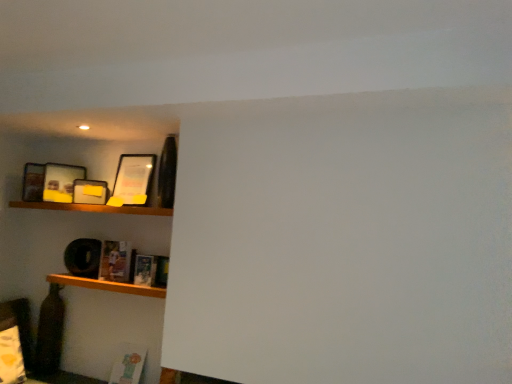
Image resolution: width=512 pixels, height=384 pixels. What do you see at coordinates (90, 192) in the screenshot? I see `matte yellow picture frame at upper left, arranged as the second picture frame when viewed from the left` at bounding box center [90, 192].

Measure the distance between point (74, 284) and camera.

Point (74, 284) and camera are 3.23 meters apart from each other.

Based on the photo, what is the approximate width of wooden shelf at upper left, the second shelf positioned from the bottom?

13.54 inches.

Find the location of `matte wooden picture frame at upper left, the third picture frame viewed from the left`. matte wooden picture frame at upper left, the third picture frame viewed from the left is located at coordinates (133, 179).

From a real-world perspective, is matte wooden picture frame at upper left, marked as the first picture frame in a right-to-left arrangement, physically located above or below matte yellow picture frame at upper left, arranged as the second picture frame when viewed from the left?

matte wooden picture frame at upper left, marked as the first picture frame in a right-to-left arrangement, is above matte yellow picture frame at upper left, arranged as the second picture frame when viewed from the left.

Does matte wooden picture frame at upper left, the third picture frame viewed from the left, turn towards matte yellow picture frame at upper left, the second picture frame when ordered from right to left?

No, matte wooden picture frame at upper left, the third picture frame viewed from the left, is not oriented towards matte yellow picture frame at upper left, the second picture frame when ordered from right to left.

Considering the sizes of matte wooden picture frame at upper left, marked as the first picture frame in a right-to-left arrangement, and matte yellow picture frame at upper left, arranged as the second picture frame when viewed from the left, in the image, is matte wooden picture frame at upper left, marked as the first picture frame in a right-to-left arrangement, bigger or smaller than matte yellow picture frame at upper left, arranged as the second picture frame when viewed from the left,?

Clearly, matte wooden picture frame at upper left, marked as the first picture frame in a right-to-left arrangement, is larger in size than matte yellow picture frame at upper left, arranged as the second picture frame when viewed from the left.

Is matte wooden picture frame at upper left, the third picture frame viewed from the left, far away from matte yellow picture frame at upper left, the second picture frame when ordered from right to left?

matte wooden picture frame at upper left, the third picture frame viewed from the left, is near matte yellow picture frame at upper left, the second picture frame when ordered from right to left, not far away.

Would you say hardcover book at lower left, which is the second book in back-to-front order, is inside or outside wooden shelf at lower left, which ranks as the 1th shelf in bottom-to-top order?

hardcover book at lower left, which is the second book in back-to-front order, exists outside the volume of wooden shelf at lower left, which ranks as the 1th shelf in bottom-to-top order.

Based on their positions, is hardcover book at lower left, the first book in the front-to-back sequence, located to the left or right of wooden shelf at lower left, the 2th shelf when ordered from top to bottom?

Based on their positions, hardcover book at lower left, the first book in the front-to-back sequence, is located to the right of wooden shelf at lower left, the 2th shelf when ordered from top to bottom.

Is hardcover book at lower left, the first book in the front-to-back sequence, beside wooden shelf at lower left, which ranks as the 1th shelf in bottom-to-top order?

No.

How much distance is there between hardcover book at lower left, which is the second book in back-to-front order, and wooden shelf at lower left, which ranks as the 1th shelf in bottom-to-top order?

They are 8.49 inches apart.

From a real-world perspective, is matte wooden picture frame at upper left, the third picture frame viewed from the left, above or below matte paper book at lower left, which appears as the 1th book when viewed from the left?

matte wooden picture frame at upper left, the third picture frame viewed from the left, is situated higher than matte paper book at lower left, which appears as the 1th book when viewed from the left, in the real world.

Is matte wooden picture frame at upper left, the third picture frame viewed from the left, oriented away from matte paper book at lower left, placed as the 2th book when sorted from right to left?

matte wooden picture frame at upper left, the third picture frame viewed from the left, does not have its back to matte paper book at lower left, placed as the 2th book when sorted from right to left.

Would you say matte wooden picture frame at upper left, marked as the first picture frame in a right-to-left arrangement, is inside or outside matte paper book at lower left, placed as the 2th book when sorted from right to left?

matte wooden picture frame at upper left, marked as the first picture frame in a right-to-left arrangement, lies outside matte paper book at lower left, placed as the 2th book when sorted from right to left.

Looking at their sizes, would you say matte yellow picture frame at upper left, arranged as the second picture frame when viewed from the left, is wider or thinner than hardcover book at lower left, which is the second book in back-to-front order?

matte yellow picture frame at upper left, arranged as the second picture frame when viewed from the left, is thinner than hardcover book at lower left, which is the second book in back-to-front order.

How different are the orientations of matte yellow picture frame at upper left, the second picture frame when ordered from right to left, and hardcover book at lower left, the second book from the left, in degrees?

The facing directions of matte yellow picture frame at upper left, the second picture frame when ordered from right to left, and hardcover book at lower left, the second book from the left, are 59.6 degrees apart.

From the image's perspective, is matte yellow picture frame at upper left, the second picture frame when ordered from right to left, beneath hardcover book at lower left, the first book in the front-to-back sequence?

No, from the image's perspective, matte yellow picture frame at upper left, the second picture frame when ordered from right to left, is not beneath hardcover book at lower left, the first book in the front-to-back sequence.

From a real-world perspective, is matte yellow picture frame at upper left, the second picture frame when ordered from right to left, physically above hardcover book at lower left, the first book in the front-to-back sequence?

Yes, from a real-world perspective, matte yellow picture frame at upper left, the second picture frame when ordered from right to left, is over hardcover book at lower left, the first book in the front-to-back sequence

Which is behind, point (102, 250) or point (120, 171)?

The point (120, 171) is behind.

Is matte paper book at lower left, which appears as the 1th book when viewed from the left, positioned with its back to matte wooden picture frame at upper left, marked as the first picture frame in a right-to-left arrangement?

No, matte wooden picture frame at upper left, marked as the first picture frame in a right-to-left arrangement, is not at the back of matte paper book at lower left, which appears as the 1th book when viewed from the left.

From a real-world perspective, which is physically below, matte paper book at lower left, the second book in the front-to-back sequence, or matte wooden picture frame at upper left, marked as the first picture frame in a right-to-left arrangement?

matte paper book at lower left, the second book in the front-to-back sequence, is physically lower.

Which of these two, matte paper book at lower left, which appears as the 1th book when viewed from the left, or matte wooden picture frame at upper left, the third picture frame viewed from the left, is thinner?

With smaller width is matte wooden picture frame at upper left, the third picture frame viewed from the left.

Based on the photo, considering the relative positions of hardcover book at lower left, the first book from the right, and matte black picture frame at upper left, arranged as the first picture frame when viewed from the left, in the image provided, is hardcover book at lower left, the first book from the right, to the right of matte black picture frame at upper left, arranged as the first picture frame when viewed from the left, from the viewer's perspective?

Indeed, hardcover book at lower left, the first book from the right, is positioned on the right side of matte black picture frame at upper left, arranged as the first picture frame when viewed from the left.

From the image's perspective, is hardcover book at lower left, the first book from the right, positioned above or below matte black picture frame at upper left, the third picture frame in the right-to-left sequence?

Clearly, from the image's perspective, hardcover book at lower left, the first book from the right, is below matte black picture frame at upper left, the third picture frame in the right-to-left sequence.

Based on the photo, considering the sizes of hardcover book at lower left, the first book in the front-to-back sequence, and matte black picture frame at upper left, arranged as the first picture frame when viewed from the left, in the image, is hardcover book at lower left, the first book in the front-to-back sequence, wider or thinner than matte black picture frame at upper left, arranged as the first picture frame when viewed from the left,?

hardcover book at lower left, the first book in the front-to-back sequence, is thinner than matte black picture frame at upper left, arranged as the first picture frame when viewed from the left.

Is there a large distance between hardcover book at lower left, the first book from the right, and matte black picture frame at upper left, arranged as the first picture frame when viewed from the left?

They are positioned close to each other.

Would you say hardcover book at lower left, the second book from the left, is part of wooden shelf at upper left, the second shelf positioned from the bottom,'s contents?

No, hardcover book at lower left, the second book from the left, is not inside wooden shelf at upper left, the second shelf positioned from the bottom.

Measure the distance between wooden shelf at upper left, marked as the 1th shelf in a top-to-bottom arrangement, and hardcover book at lower left, the first book from the right.

wooden shelf at upper left, marked as the 1th shelf in a top-to-bottom arrangement, is 20.15 inches away from hardcover book at lower left, the first book from the right.

Does wooden shelf at upper left, marked as the 1th shelf in a top-to-bottom arrangement, turn towards hardcover book at lower left, the second book from the left?

No.

Which of these two, wooden shelf at upper left, the second shelf positioned from the bottom, or hardcover book at lower left, which is the second book in back-to-front order, stands shorter?

Standing shorter between the two is wooden shelf at upper left, the second shelf positioned from the bottom.

There is a matte wooden picture frame at upper left, the third picture frame viewed from the left. Find the location of `the 2nd picture frame below it (from a real-world perspective)`. the 2nd picture frame below it (from a real-world perspective) is located at coordinates (90, 192).

You are a GUI agent. You are given a task and a screenshot of the screen. Output one action in this format:
    pyautogui.click(x=<x>, y=<y>)
    Task: Click on the 1st shelf counting from the left side of the hardcover book at lower left, the first book from the right
    The height and width of the screenshot is (384, 512).
    Given the screenshot: What is the action you would take?
    pyautogui.click(x=106, y=285)

Looking at the image, which one is located further to wooden shelf at lower left, which ranks as the 1th shelf in bottom-to-top order, matte yellow picture frame at upper left, arranged as the second picture frame when viewed from the left, or wooden shelf at upper left, the second shelf positioned from the bottom?

The object further to wooden shelf at lower left, which ranks as the 1th shelf in bottom-to-top order, is matte yellow picture frame at upper left, arranged as the second picture frame when viewed from the left.

Estimate the real-world distances between objects in this image. Which object is closer to matte wooden picture frame at upper left, the third picture frame viewed from the left, matte paper book at lower left, placed as the 2th book when sorted from right to left, or wooden shelf at upper left, the second shelf positioned from the bottom?

The object closer to matte wooden picture frame at upper left, the third picture frame viewed from the left, is wooden shelf at upper left, the second shelf positioned from the bottom.

Looking at the image, which one is located closer to matte paper book at lower left, arranged as the first book when viewed from the back, hardcover book at lower left, the second book from the left, or wooden shelf at upper left, marked as the 1th shelf in a top-to-bottom arrangement?

The object closer to matte paper book at lower left, arranged as the first book when viewed from the back, is hardcover book at lower left, the second book from the left.

Considering their positions, is wooden shelf at lower left, which ranks as the 1th shelf in bottom-to-top order, positioned closer to matte black picture frame at upper left, arranged as the first picture frame when viewed from the left, than matte yellow picture frame at upper left, the second picture frame when ordered from right to left?

The object closer to matte black picture frame at upper left, arranged as the first picture frame when viewed from the left, is matte yellow picture frame at upper left, the second picture frame when ordered from right to left.

Which object lies nearer to the anchor point matte wooden picture frame at upper left, the third picture frame viewed from the left, matte paper book at lower left, arranged as the first book when viewed from the back, or wooden shelf at lower left, the 2th shelf when ordered from top to bottom?

matte paper book at lower left, arranged as the first book when viewed from the back, is closer to matte wooden picture frame at upper left, the third picture frame viewed from the left.

Looking at the image, which one is located closer to hardcover book at lower left, which is the second book in back-to-front order, wooden shelf at lower left, which ranks as the 1th shelf in bottom-to-top order, or matte black picture frame at upper left, arranged as the first picture frame when viewed from the left?

The object closer to hardcover book at lower left, which is the second book in back-to-front order, is wooden shelf at lower left, which ranks as the 1th shelf in bottom-to-top order.

Based on the photo, from the image, which object appears to be farther from wooden shelf at lower left, which ranks as the 1th shelf in bottom-to-top order, matte black picture frame at upper left, arranged as the first picture frame when viewed from the left, or matte paper book at lower left, which appears as the 1th book when viewed from the left?

matte black picture frame at upper left, arranged as the first picture frame when viewed from the left, lies further to wooden shelf at lower left, which ranks as the 1th shelf in bottom-to-top order, than the other object.

When comparing their distances from wooden shelf at lower left, the 2th shelf when ordered from top to bottom, does wooden shelf at upper left, the second shelf positioned from the bottom, or matte paper book at lower left, arranged as the first book when viewed from the back, seem closer?

Based on the image, matte paper book at lower left, arranged as the first book when viewed from the back, appears to be nearer to wooden shelf at lower left, the 2th shelf when ordered from top to bottom.

At what (x,y) coordinates should I click in order to perform the action: click on shelf that lies between matte yellow picture frame at upper left, the second picture frame when ordered from right to left, and wooden shelf at lower left, which ranks as the 1th shelf in bottom-to-top order, from top to bottom. Please return your answer as a coordinate pair (x, y). The image size is (512, 384). Looking at the image, I should click on (93, 208).

Identify the location of picture frame between wooden shelf at upper left, marked as the 1th shelf in a top-to-bottom arrangement, and matte yellow picture frame at upper left, the second picture frame when ordered from right to left, along the z-axis. (133, 179).

Image resolution: width=512 pixels, height=384 pixels. I want to click on shelf between matte wooden picture frame at upper left, marked as the first picture frame in a right-to-left arrangement, and wooden shelf at lower left, the 2th shelf when ordered from top to bottom, vertically, so click(93, 208).

You are a GUI agent. You are given a task and a screenshot of the screen. Output one action in this format:
    pyautogui.click(x=<x>, y=<y>)
    Task: Click on the book between matte black picture frame at upper left, arranged as the first picture frame when viewed from the left, and hardcover book at lower left, the first book from the right, from left to right
    
    Given the screenshot: What is the action you would take?
    pyautogui.click(x=115, y=261)